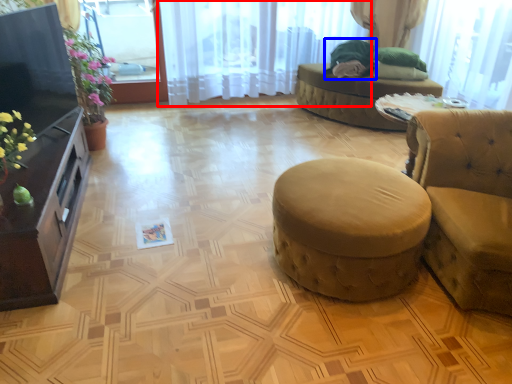
Question: Among these objects, which one is farthest to the camera, curtain (highlighted by a red box) or open (highlighted by a blue box)?

Choices:
 (A) curtain
 (B) open

Answer: (B)